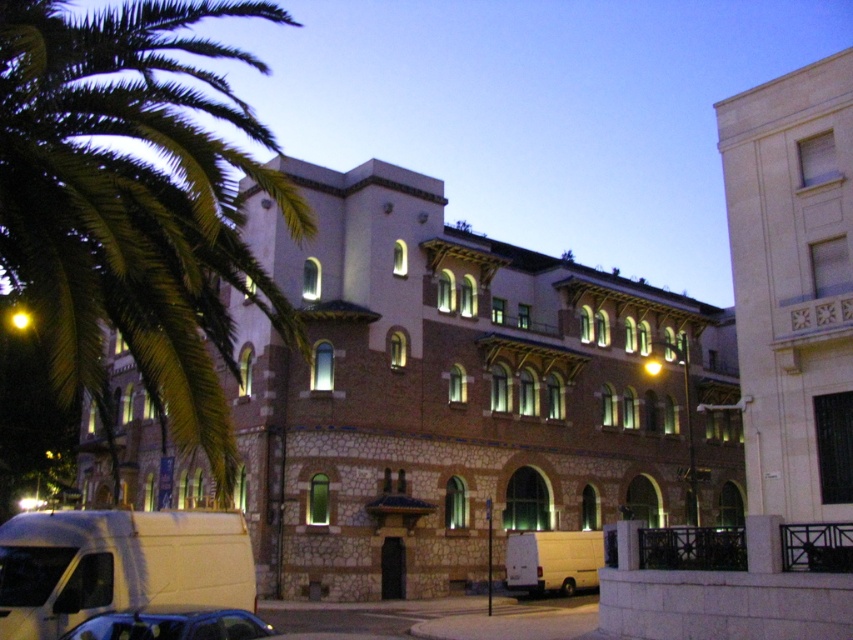
Who is shorter, green leafy palm tree at upper left or white matte van at lower left?

white matte van at lower left

Is point (131, 156) less distant than point (138, 593)?

No, (131, 156) is behind (138, 593).

What are the coordinates of `green leafy palm tree at upper left` in the screenshot? It's located at (132, 205).

Can you confirm if white matte van at lower left is shorter than metallic blue car at lower left?

No.

Which is in front, point (218, 563) or point (138, 637)?

Point (138, 637) is in front.

The image size is (853, 640). I want to click on white matte van at lower left, so click(117, 564).

Between point (244, 564) and point (514, 541), which one is positioned in front?

Point (244, 564) is more forward.

Does point (27, 557) come in front of point (521, 557)?

Yes, point (27, 557) is closer to viewer.

This screenshot has height=640, width=853. Find the location of `white matte van at lower left`. white matte van at lower left is located at coordinates 117,564.